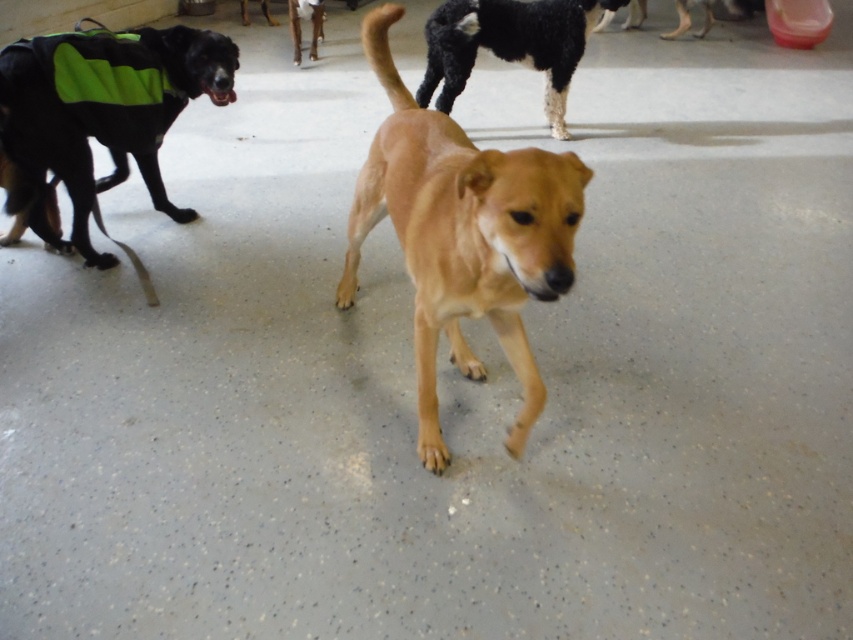
Question: Which of the following is the closest to the observer?

Choices:
 (A) green reflective vest at left
 (B) golden fur dog at center

Answer: (B)

Question: Considering the relative positions of black fuzzy dog at upper center and brown matte dog at center in the image provided, where is black fuzzy dog at upper center located with respect to brown matte dog at center?

Choices:
 (A) below
 (B) above

Answer: (A)

Question: Which point appears closest to the camera in this image?

Choices:
 (A) (48, 44)
 (B) (311, 12)
 (C) (451, 218)
 (D) (495, 42)

Answer: (C)

Question: Which of the following is the farthest from the observer?

Choices:
 (A) brown matte dog at center
 (B) black fuzzy dog at upper center
 (C) green reflective vest at left

Answer: (A)

Question: Can you confirm if golden fur dog at center is thinner than green reflective vest at left?

Choices:
 (A) no
 (B) yes

Answer: (B)

Question: Is the position of golden fur dog at center less distant than that of brown matte dog at center?

Choices:
 (A) no
 (B) yes

Answer: (B)